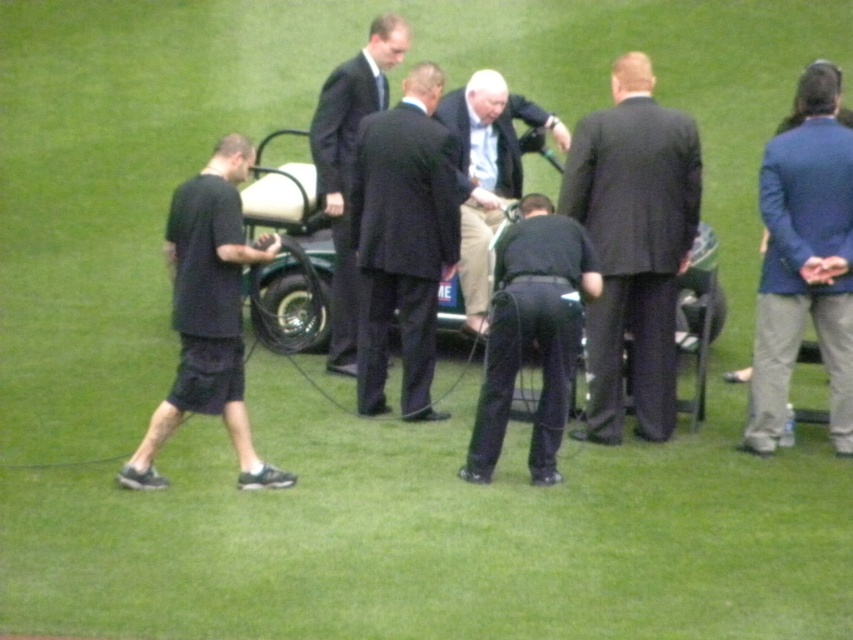
Who is positioned more to the left, dark suit at center or light blue shirt at center?

From the viewer's perspective, light blue shirt at center appears more on the left side.

Does point (650, 346) come closer to viewer compared to point (490, 90)?

Yes, it is in front of point (490, 90).

The image size is (853, 640). What are the coordinates of `dark suit at center` in the screenshot? It's located at (633, 244).

Image resolution: width=853 pixels, height=640 pixels. I want to click on dark suit at center, so (x=633, y=244).

Is black matte camera at center positioned before dark blue suit at center?

Yes, it is.

Can you confirm if black matte camera at center is bigger than dark blue suit at center?

No.

Who is more distant from viewer, (534,324) or (332,164)?

Point (332,164)

At what (x,y) coordinates should I click in order to perform the action: click on black matte camera at center. Please return your answer as a coordinate pair (x, y). Looking at the image, I should click on (532, 332).

Can you confirm if black matte camera at center is thinner than light blue shirt at center?

Correct, black matte camera at center's width is less than light blue shirt at center's.

Can you confirm if black matte camera at center is taller than light blue shirt at center?

In fact, black matte camera at center may be shorter than light blue shirt at center.

Between point (496, 372) and point (469, 164), which one is positioned in front?

Positioned in front is point (496, 372).

The width and height of the screenshot is (853, 640). Find the location of `black matte camera at center`. black matte camera at center is located at coordinates (532, 332).